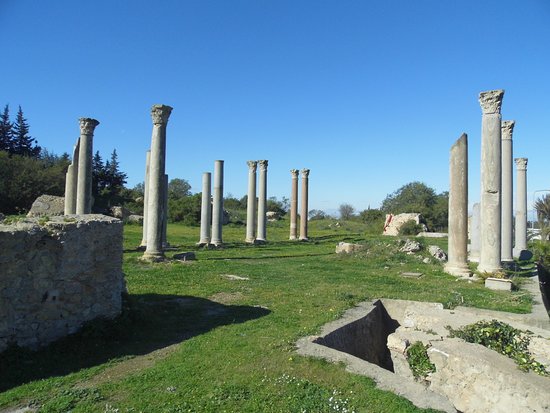
Identify the location of columns. The height and width of the screenshot is (413, 550). (495, 223).